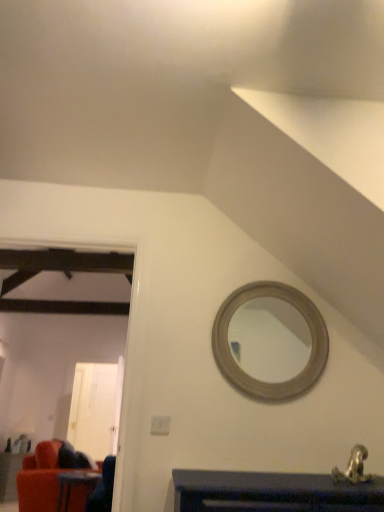
Question: From the image's perspective, is white glossy door at left below velvet red couch at lower left, arranged as the 1th table when viewed from the back?

Choices:
 (A) yes
 (B) no

Answer: (B)

Question: Can you confirm if white glossy door at left is wider than velvet red couch at lower left, the first table in the bottom-to-top sequence?

Choices:
 (A) yes
 (B) no

Answer: (B)

Question: Can we say white glossy door at left lies outside velvet red couch at lower left, acting as the second table starting from the right?

Choices:
 (A) yes
 (B) no

Answer: (A)

Question: Is velvet red couch at lower left, the first table in the bottom-to-top sequence, at the back of white glossy door at left?

Choices:
 (A) no
 (B) yes

Answer: (A)

Question: Considering the relative sizes of white glossy door at left and velvet red couch at lower left, placed as the first table when sorted from left to right, in the image provided, is white glossy door at left taller than velvet red couch at lower left, placed as the first table when sorted from left to right,?

Choices:
 (A) no
 (B) yes

Answer: (B)

Question: From a real-world perspective, is white glossy door at left positioned over velvet red couch at lower left, acting as the second table starting from the right, based on gravity?

Choices:
 (A) no
 (B) yes

Answer: (B)

Question: From a real-world perspective, is white glossy door at left physically above wooden table at lower left, acting as the first table starting from the front?

Choices:
 (A) yes
 (B) no

Answer: (A)

Question: Is white glossy door at left shorter than wooden table at lower left, placed as the 1th table when sorted from top to bottom?

Choices:
 (A) no
 (B) yes

Answer: (A)

Question: Can you confirm if white glossy door at left is bigger than wooden table at lower left, acting as the first table starting from the front?

Choices:
 (A) yes
 (B) no

Answer: (A)

Question: Does white glossy door at left have a greater width compared to wooden table at lower left, the first table when ordered from right to left?

Choices:
 (A) yes
 (B) no

Answer: (B)

Question: From the image's perspective, is white glossy door at left below wooden table at lower left, placed as the 1th table when sorted from top to bottom?

Choices:
 (A) yes
 (B) no

Answer: (A)

Question: Is white glossy door at left not inside wooden table at lower left, the first table when ordered from right to left?

Choices:
 (A) yes
 (B) no

Answer: (A)

Question: Is velvet red couch at lower left, placed as the 2th table when sorted from top to bottom, completely or partially inside wooden table at lower left, placed as the 1th table when sorted from top to bottom?

Choices:
 (A) yes
 (B) no

Answer: (B)